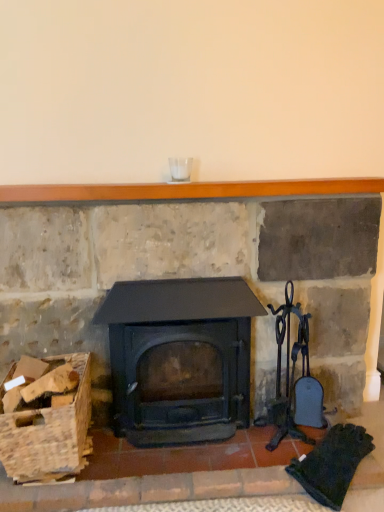
The width and height of the screenshot is (384, 512). I want to click on vacant area that is in front of matte black wood burning stove at center, so click(188, 477).